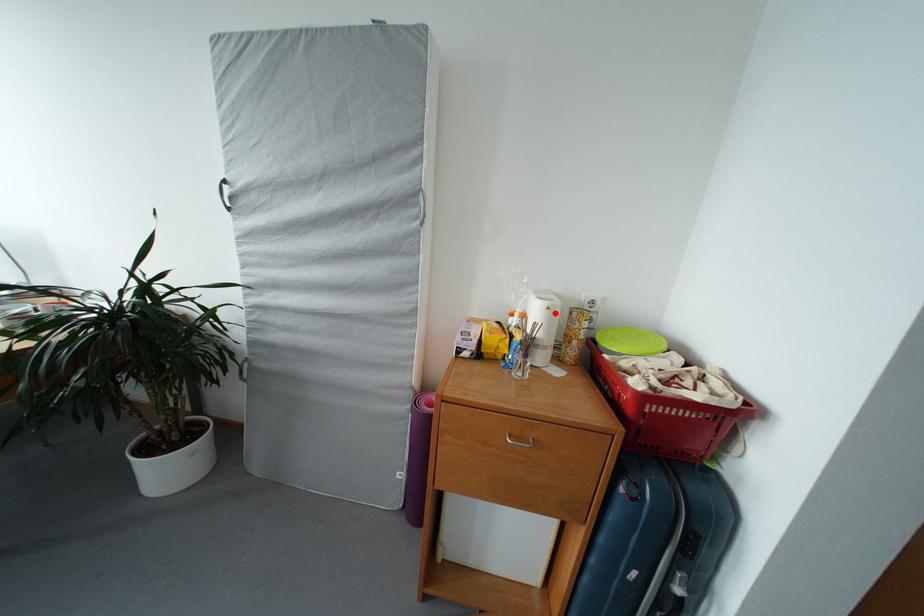
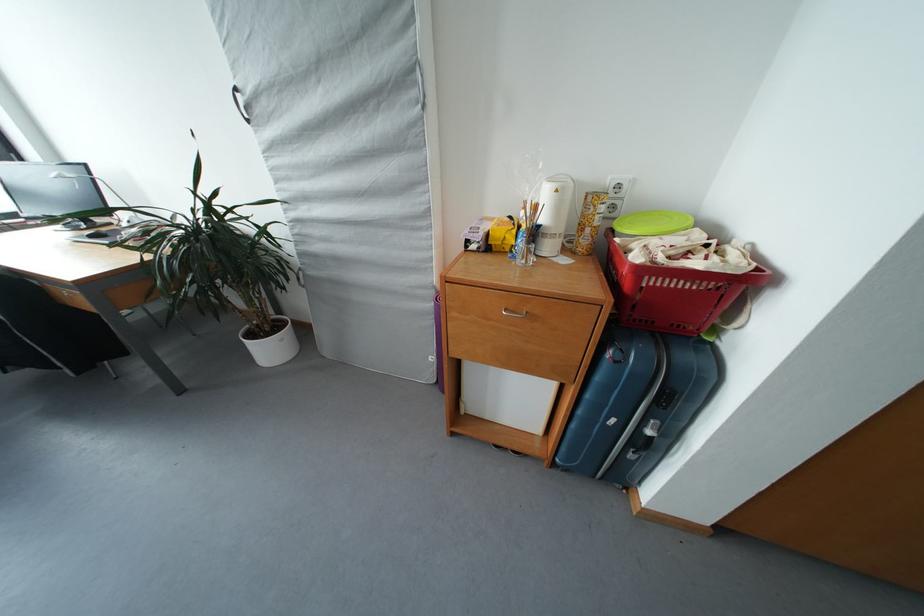
Question: I am providing you with two images of the same scene from different viewpoints. A red point is marked on the first image. At the location where the point appears in image 1, is it still visible in image 2?

Choices:
 (A) Yes
 (B) No

Answer: (A)